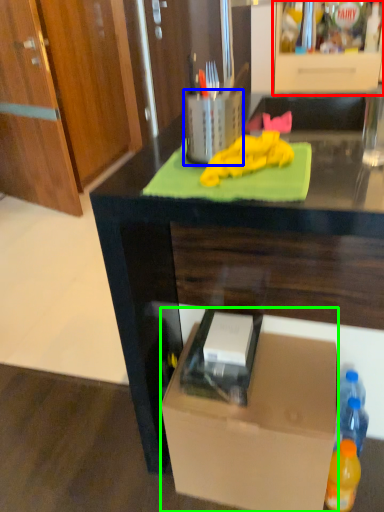
Question: Based on their relative distances, which object is nearer to cabinetry (highlighted by a red box)? Choose from appliance (highlighted by a blue box) and box (highlighted by a green box).

Choices:
 (A) appliance
 (B) box

Answer: (A)